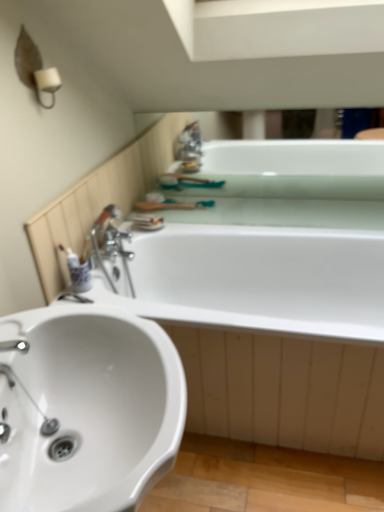
Question: Is white glossy toothbrush at left at the back of white glossy bathtub at center, which is the 1th bath from bottom to top?

Choices:
 (A) yes
 (B) no

Answer: (B)

Question: Does white glossy bathtub at center, the 2th bath from the top, lie in front of white glossy toothbrush at left?

Choices:
 (A) yes
 (B) no

Answer: (A)

Question: Does white glossy bathtub at center, which is the 1th bath from bottom to top, have a smaller size compared to white glossy toothbrush at left?

Choices:
 (A) yes
 (B) no

Answer: (B)

Question: From the image's perspective, is white glossy bathtub at center, the 2th bath from the top, above white glossy toothbrush at left?

Choices:
 (A) yes
 (B) no

Answer: (B)

Question: Considering the relative sizes of white glossy bathtub at center, the 2th bath from the top, and white glossy toothbrush at left in the image provided, is white glossy bathtub at center, the 2th bath from the top, shorter than white glossy toothbrush at left?

Choices:
 (A) no
 (B) yes

Answer: (A)

Question: From a real-world perspective, is white glossy bathtub at center, the 2th bath from the top, physically below white glossy toothbrush at left?

Choices:
 (A) yes
 (B) no

Answer: (A)

Question: From a real-world perspective, is white glossy toothbrush at left over white glossy bathtub at center, which is the 1th bath from bottom to top?

Choices:
 (A) yes
 (B) no

Answer: (A)

Question: Does white glossy toothbrush at left have a greater height compared to white glossy bathtub at center, the 2th bath from the top?

Choices:
 (A) yes
 (B) no

Answer: (B)

Question: Can you confirm if white glossy toothbrush at left is positioned to the right of white glossy bathtub at center, which is the 1th bath from bottom to top?

Choices:
 (A) yes
 (B) no

Answer: (B)

Question: Is white glossy toothbrush at left to the left of white glossy bathtub at center, the 2th bath from the top, from the viewer's perspective?

Choices:
 (A) no
 (B) yes

Answer: (B)

Question: Can we say white glossy toothbrush at left lies outside white glossy bathtub at center, which is the 1th bath from bottom to top?

Choices:
 (A) no
 (B) yes

Answer: (B)

Question: From a real-world perspective, does white glossy toothbrush at left sit lower than white glossy bathtub at center, which is the 1th bath from bottom to top?

Choices:
 (A) yes
 (B) no

Answer: (B)

Question: From a real-world perspective, is white glossy bathtub at upper center, the second bath from the bottom, below white glossy toothbrush at left?

Choices:
 (A) no
 (B) yes

Answer: (A)